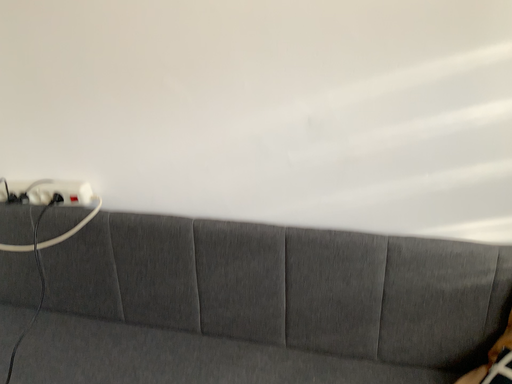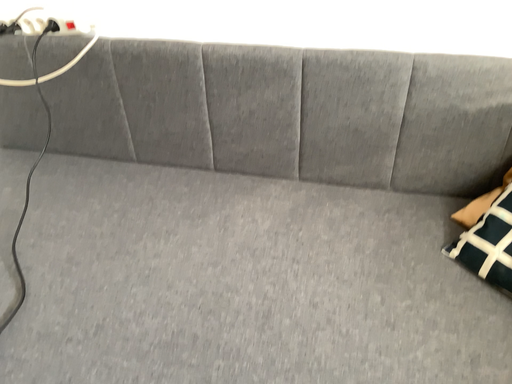
Question: How did the camera likely rotate when shooting the video?

Choices:
 (A) rotated upward
 (B) rotated downward

Answer: (B)